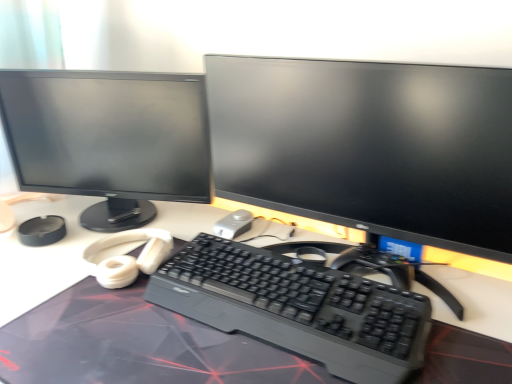
This screenshot has height=384, width=512. In order to click on free space behind black plastic keyboard at center in this screenshot , I will do `click(258, 222)`.